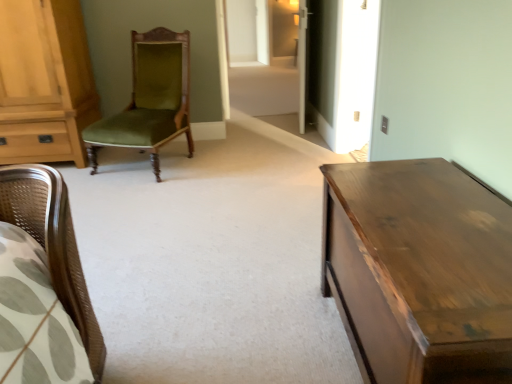
Question: Can you confirm if light brown wood cabinet at left is taller than shiny brown wooden table at right?

Choices:
 (A) yes
 (B) no

Answer: (A)

Question: Is light brown wood cabinet at left further to camera compared to shiny brown wooden table at right?

Choices:
 (A) no
 (B) yes

Answer: (B)

Question: Considering the relative sizes of light brown wood cabinet at left and shiny brown wooden table at right in the image provided, is light brown wood cabinet at left wider than shiny brown wooden table at right?

Choices:
 (A) no
 (B) yes

Answer: (B)

Question: Considering the relative sizes of light brown wood cabinet at left and shiny brown wooden table at right in the image provided, is light brown wood cabinet at left shorter than shiny brown wooden table at right?

Choices:
 (A) yes
 (B) no

Answer: (B)

Question: From the image's perspective, is light brown wood cabinet at left under shiny brown wooden table at right?

Choices:
 (A) no
 (B) yes

Answer: (A)

Question: From the image's perspective, is green velvet chair at center positioned above or below light brown wood cabinet at left?

Choices:
 (A) below
 (B) above

Answer: (A)

Question: In terms of size, does green velvet chair at center appear bigger or smaller than light brown wood cabinet at left?

Choices:
 (A) big
 (B) small

Answer: (B)

Question: Does point (116, 142) appear closer or farther from the camera than point (10, 34)?

Choices:
 (A) farther
 (B) closer

Answer: (B)

Question: Is green velvet chair at center in front of or behind light brown wood cabinet at left in the image?

Choices:
 (A) front
 (B) behind

Answer: (A)

Question: Considering the positions of light brown wood cabinet at left and shiny brown wooden table at right in the image, is light brown wood cabinet at left taller or shorter than shiny brown wooden table at right?

Choices:
 (A) tall
 (B) short

Answer: (A)

Question: Considering the positions of point (76, 56) and point (336, 205), is point (76, 56) closer or farther from the camera than point (336, 205)?

Choices:
 (A) closer
 (B) farther

Answer: (B)

Question: From the image's perspective, is light brown wood cabinet at left located above or below shiny brown wooden table at right?

Choices:
 (A) above
 (B) below

Answer: (A)

Question: Looking at the image, does light brown wood cabinet at left seem bigger or smaller compared to shiny brown wooden table at right?

Choices:
 (A) big
 (B) small

Answer: (A)

Question: In terms of height, does shiny brown wooden table at right look taller or shorter compared to light brown wood cabinet at left?

Choices:
 (A) tall
 (B) short

Answer: (B)

Question: Is shiny brown wooden table at right spatially inside light brown wood cabinet at left, or outside of it?

Choices:
 (A) inside
 (B) outside

Answer: (B)